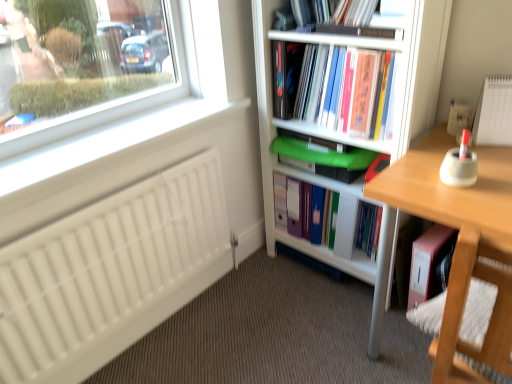
Question: Should I look upward or downward to see green plastic tray at center, marked as the third book in a bottom-to-top arrangement?

Choices:
 (A) up
 (B) down

Answer: (A)

Question: Is matte plastic shelf at center bigger than wooden swivel chair at lower right?

Choices:
 (A) yes
 (B) no

Answer: (B)

Question: Is matte plastic shelf at center positioned far away from wooden swivel chair at lower right?

Choices:
 (A) yes
 (B) no

Answer: (B)

Question: Is matte plastic shelf at center not inside wooden swivel chair at lower right?

Choices:
 (A) no
 (B) yes

Answer: (B)

Question: Can you confirm if matte plastic shelf at center is smaller than wooden swivel chair at lower right?

Choices:
 (A) yes
 (B) no

Answer: (A)

Question: Is matte plastic shelf at center thinner than wooden swivel chair at lower right?

Choices:
 (A) no
 (B) yes

Answer: (B)

Question: Considering the relative sizes of matte plastic shelf at center and wooden swivel chair at lower right in the image provided, is matte plastic shelf at center shorter than wooden swivel chair at lower right?

Choices:
 (A) no
 (B) yes

Answer: (B)

Question: Does wooden desk at right have a greater width compared to hardcover book at center, the 2th book viewed from the top?

Choices:
 (A) no
 (B) yes

Answer: (B)

Question: From a real-world perspective, is wooden desk at right beneath hardcover book at center, positioned as the 4th book in bottom-to-top order?

Choices:
 (A) no
 (B) yes

Answer: (B)

Question: From a real-world perspective, is wooden desk at right on hardcover book at center, the 2th book viewed from the top?

Choices:
 (A) no
 (B) yes

Answer: (A)

Question: Can you confirm if wooden desk at right is smaller than hardcover book at center, the 2th book viewed from the top?

Choices:
 (A) no
 (B) yes

Answer: (A)

Question: Is wooden desk at right facing away from hardcover book at center, positioned as the 4th book in bottom-to-top order?

Choices:
 (A) yes
 (B) no

Answer: (B)

Question: Is wooden desk at right taller than hardcover book at center, positioned as the 4th book in bottom-to-top order?

Choices:
 (A) no
 (B) yes

Answer: (B)

Question: Is green plastic folder at center, which ranks as the 2th book in bottom-to-top order, thinner than wooden desk at right?

Choices:
 (A) yes
 (B) no

Answer: (A)